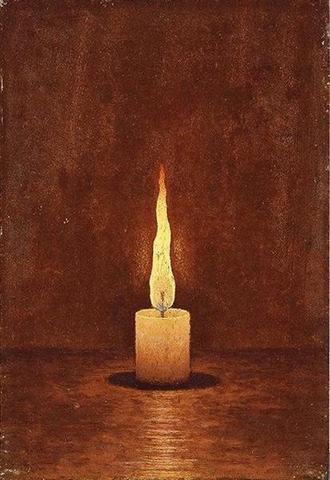
Find the location of a particular element. The height and width of the screenshot is (480, 330). candle's shadow is located at coordinates (132, 386), (195, 381).